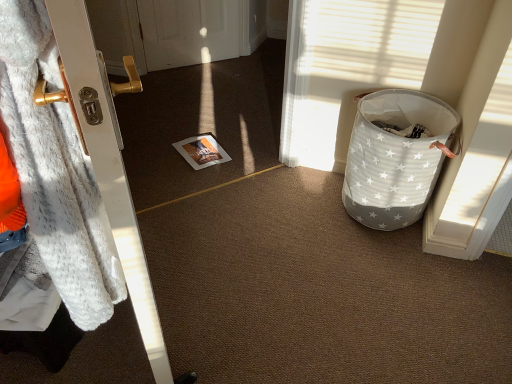
Where is `vacant region under fuzzy white blanket at left (from a real-world perspective)`? vacant region under fuzzy white blanket at left (from a real-world perspective) is located at coordinates (109, 350).